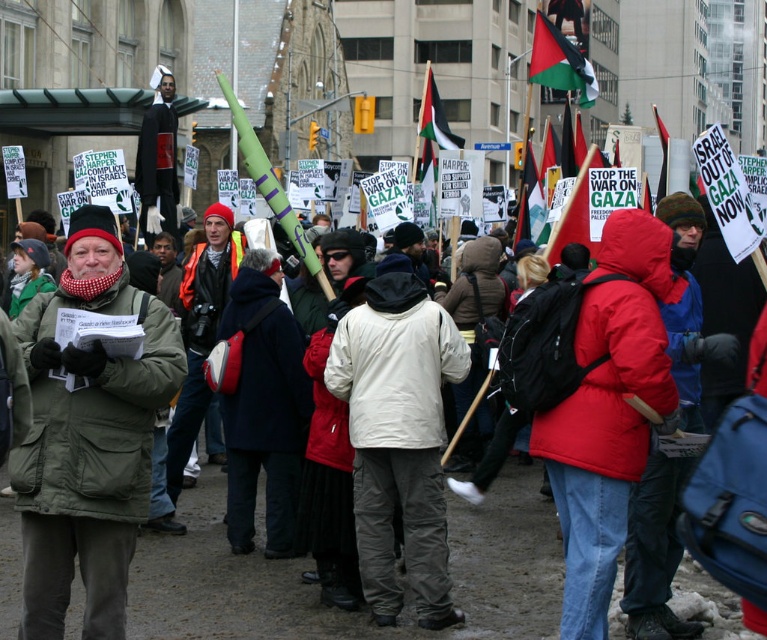
You are a photographer standing at the front of the protest crowd. You want to take a photo that includes both the matte red jacket at center and the palestinian flag at upper center. Which object will appear wider in the photo?

The matte red jacket at center has a lesser width compared to the palestinian flag at upper center, so the palestinian flag at upper center will appear wider in the photo.

You are a photographer trying to capture the protest scene. You notice the green matte jacket at center and the palestinian flag at upper center in your frame. Which object appears narrower in your photo?

The green matte jacket at center appears narrower than the palestinian flag at upper center in the photo.